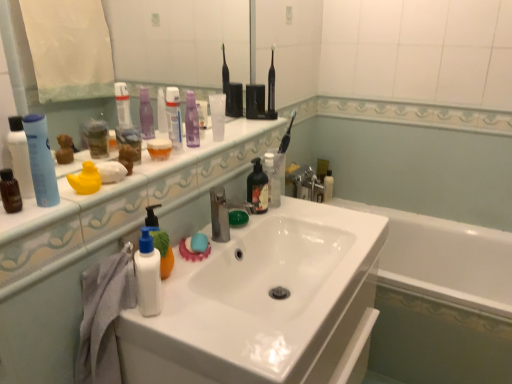
Where is `vacant space that is in between transparent plastic mouthwash at center, the fourth mouthwash from the left, and translucent plastic cup at center, arranged as the second mouthwash when viewed from the left`? vacant space that is in between transparent plastic mouthwash at center, the fourth mouthwash from the left, and translucent plastic cup at center, arranged as the second mouthwash when viewed from the left is located at coordinates (x=196, y=149).